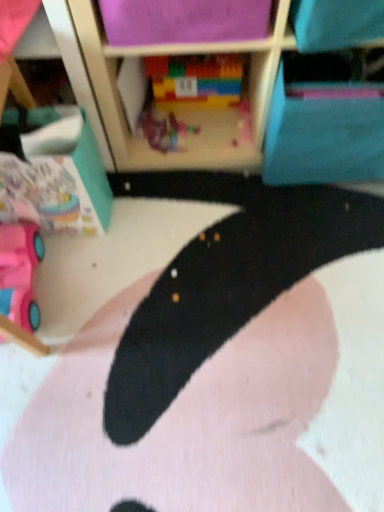
Identify the location of vacant area that is in front of multicolored plastic blocks at center, the 1th toy positioned from the right. (213, 138).